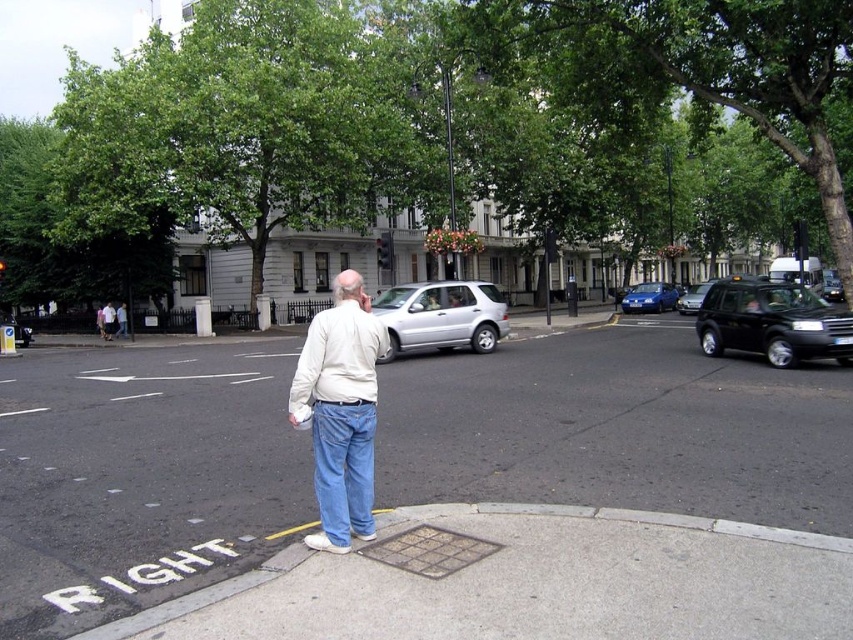
You are a pedestrian standing on the sidewalk and see the white cotton shirt at center and the metallic blue hatchback at right. Which object is closer to the ground?

The white cotton shirt at center is closer to the ground because it is below the metallic blue hatchback at right.

You are a delivery driver who needs to park your shiny black suv at right as close as possible to the sidewalk where the man is standing. Given that the parking space must be at least 10 meters away from the man to avoid blocking pedestrian access, is the current distance sufficient?

The distance between the shiny black suv at right and the camera is 13.18 meters. Since the parking space must be at least 10 meters away from the man, the current distance of 13.18 meters is sufficient and meets the requirement.

You are a delivery robot navigating a residential street. You need to move from your current position to a delivery point. There are two points marked in the scene. Which point is closer to you, point (349, 483) or point (669, 292)?

→ Point (349, 483) is in front of point (669, 292), so it is closer to you.